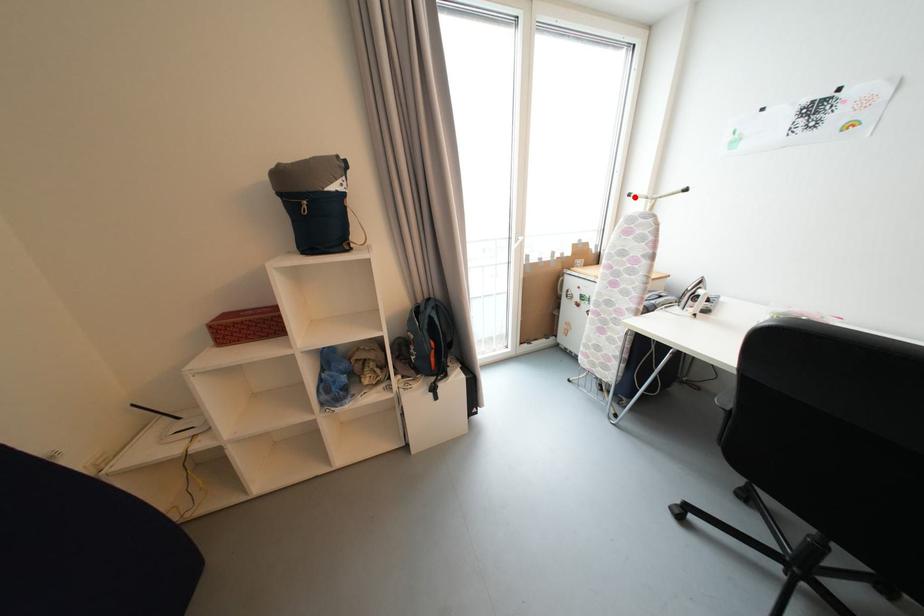
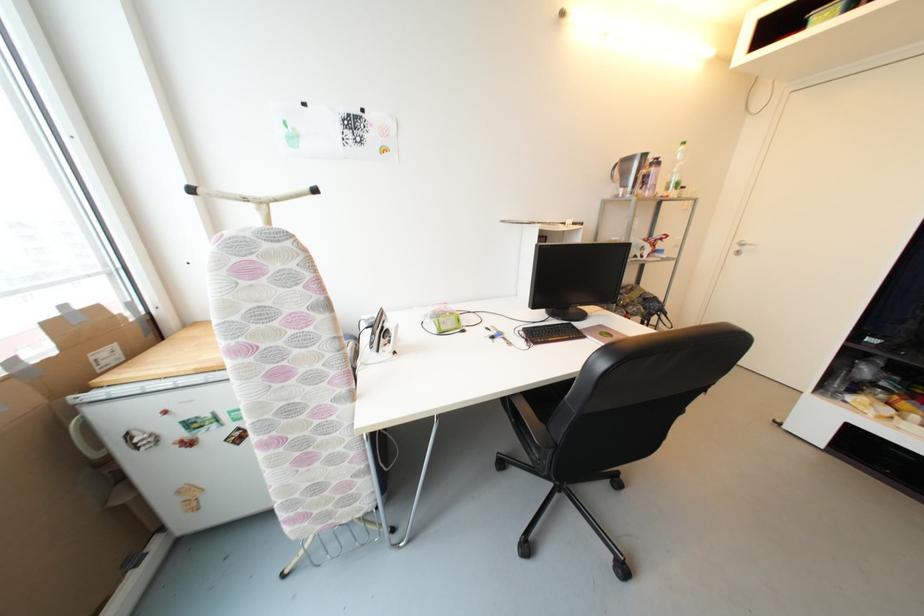
Question: I am providing you with two images of the same scene from different viewpoints. Given a red point in image1, look at the same physical point in image2. Is it:

Choices:
 (A) Closer to the viewpoint
 (B) Farther from the viewpoint

Answer: (B)